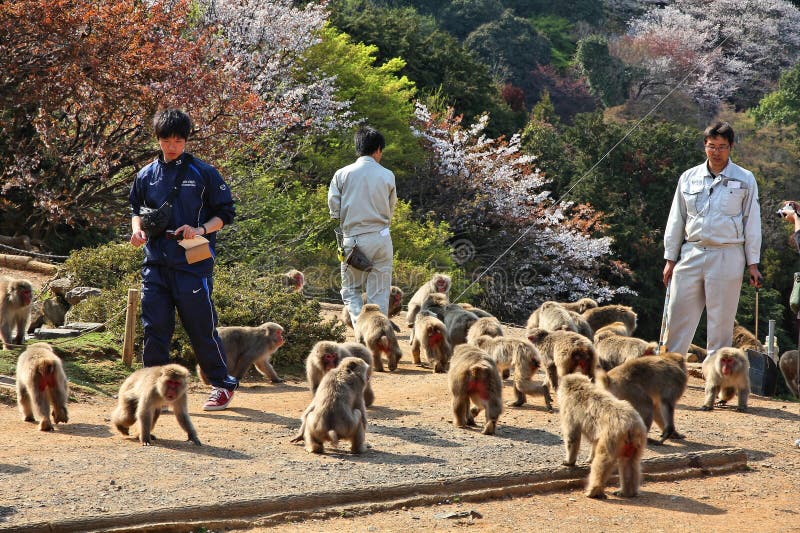
Where is `box`? box is located at coordinates (193, 256).